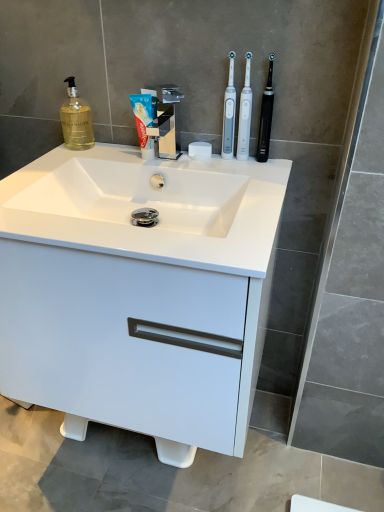
Locate an element on the screen. This screenshot has height=512, width=384. vacant area that is in front of white plastic toothbrush at upper right, the first toothbrush positioned from the left is located at coordinates (243, 176).